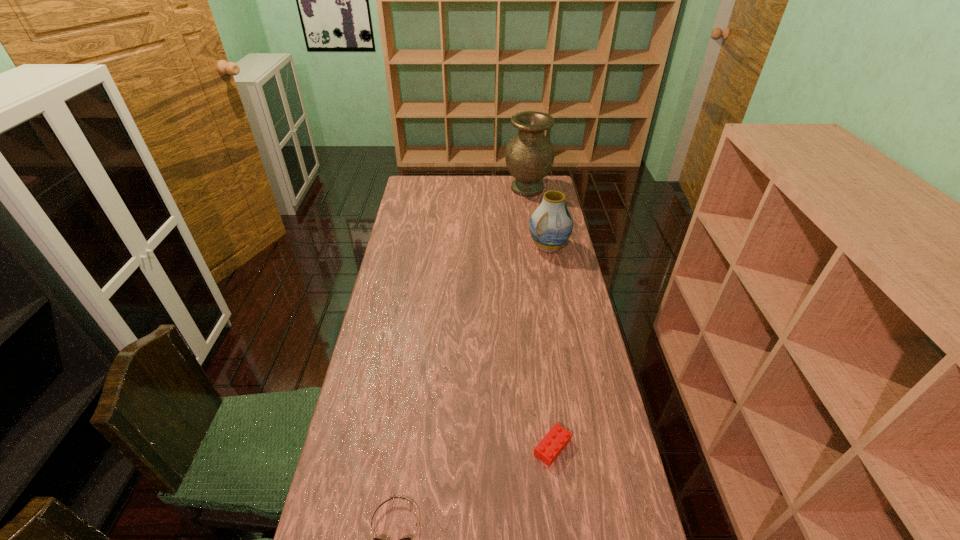
Locate an element on the screen. The height and width of the screenshot is (540, 960). object that is at the far right corner is located at coordinates (529, 156).

Identify the location of free region at the far edge. (469, 188).

Where is `free spot at the left edge of the desktop`? The width and height of the screenshot is (960, 540). free spot at the left edge of the desktop is located at coordinates (370, 378).

The width and height of the screenshot is (960, 540). I want to click on vacant space at the right edge of the desktop, so click(x=577, y=400).

Locate an element on the screen. Image resolution: width=960 pixels, height=540 pixels. vacant space at the far left corner is located at coordinates (422, 192).

Identify the location of free space between the Lego and the farthest object. (540, 318).

Locate an element on the screen. unoccupied position between the shorter vase and the Lego is located at coordinates (550, 347).

Find the location of `the third closest object to the third farthest object`. the third closest object to the third farthest object is located at coordinates (529, 156).

Locate an element on the screen. This screenshot has height=540, width=960. the closest object to the nearer vase is located at coordinates (529, 156).